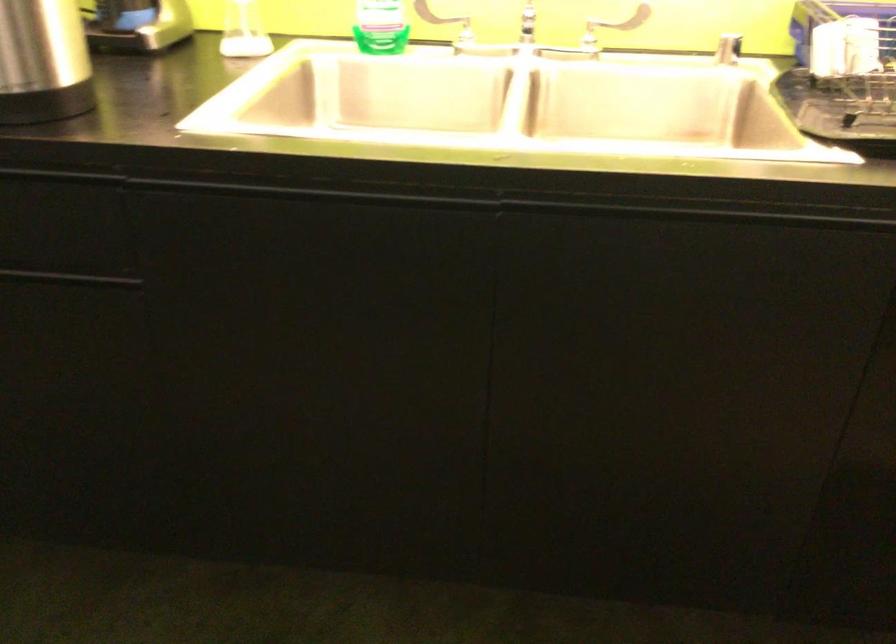
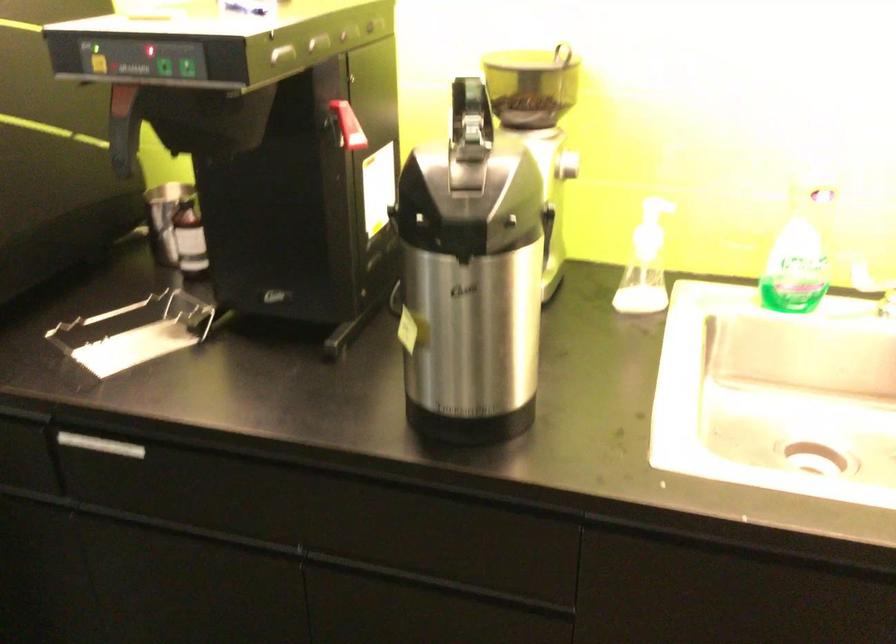
Question: The camera is either moving clockwise (left) or counter-clockwise (right) around the object. The first image is from the beginning of the video and the second image is from the end. Is the camera moving left or right when shooting the video?

Choices:
 (A) Left
 (B) Right

Answer: (B)